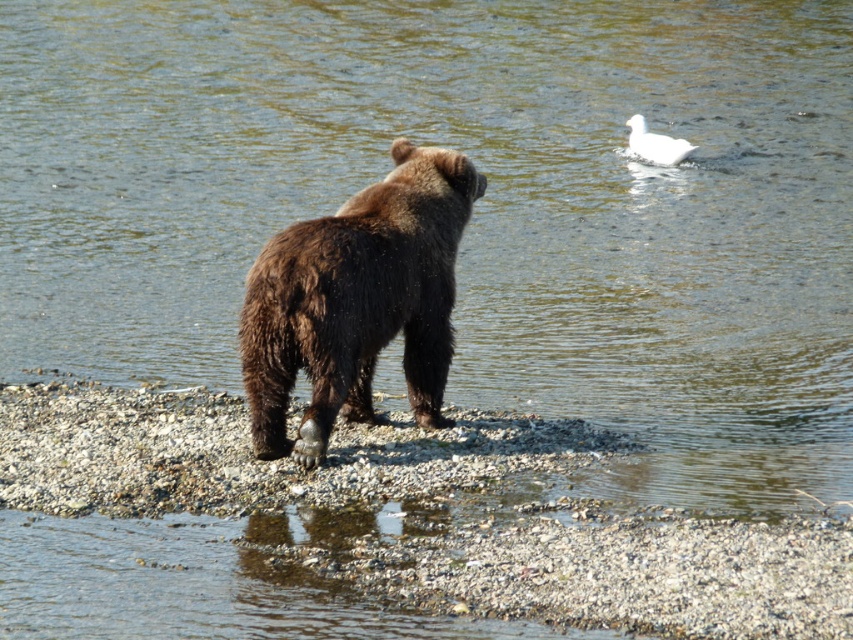
Who is more forward, (705,573) or (675,141)?

Point (705,573) is in front.

Does smooth gravel shore at center have a greater height compared to white matte duck at upper right?

Indeed, smooth gravel shore at center has a greater height compared to white matte duck at upper right.

Find the location of a particular element. This screenshot has height=640, width=853. smooth gravel shore at center is located at coordinates (431, 509).

Is point (390, 328) farther from viewer compared to point (646, 124)?

No, (390, 328) is in front of (646, 124).

Between brown furry bear at center and white matte duck at upper right, which one has less height?

Standing shorter between the two is white matte duck at upper right.

Is point (367, 380) behind point (654, 134)?

No, it is in front of (654, 134).

The height and width of the screenshot is (640, 853). Find the location of `brown furry bear at center`. brown furry bear at center is located at coordinates (357, 301).

Is point (372, 500) positioned in front of point (369, 362)?

Yes, it is in front of point (369, 362).

You are a GUI agent. You are given a task and a screenshot of the screen. Output one action in this format:
    pyautogui.click(x=<x>, y=<y>)
    Task: Click on the smooth gravel shore at center
    This screenshot has width=853, height=640.
    Given the screenshot: What is the action you would take?
    pyautogui.click(x=431, y=509)

The image size is (853, 640). In order to click on smooth gravel shore at center in this screenshot , I will do `click(431, 509)`.